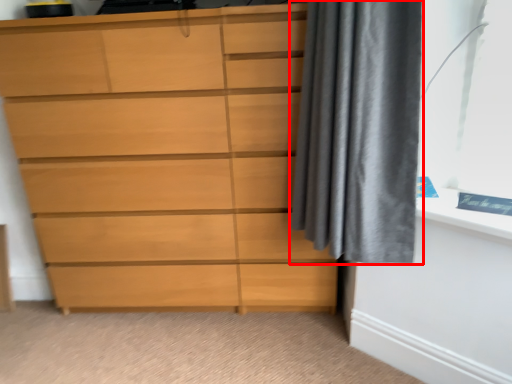
Question: From the image's perspective, where is curtain (annotated by the red box) located in relation to chest of drawers in the image?

Choices:
 (A) above
 (B) below

Answer: (A)